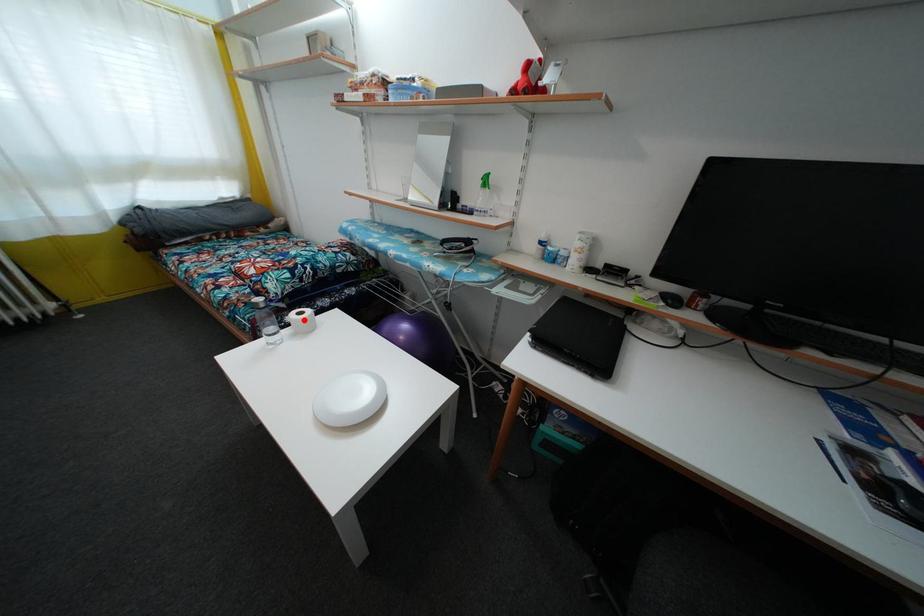
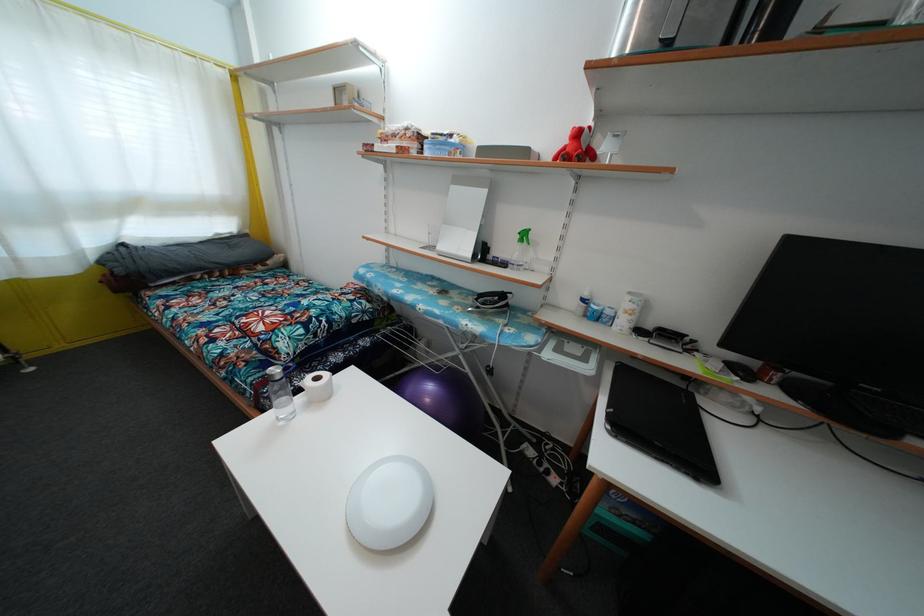
Find the pixel in the second image that matches the highlighted location in the first image.

(321, 386)